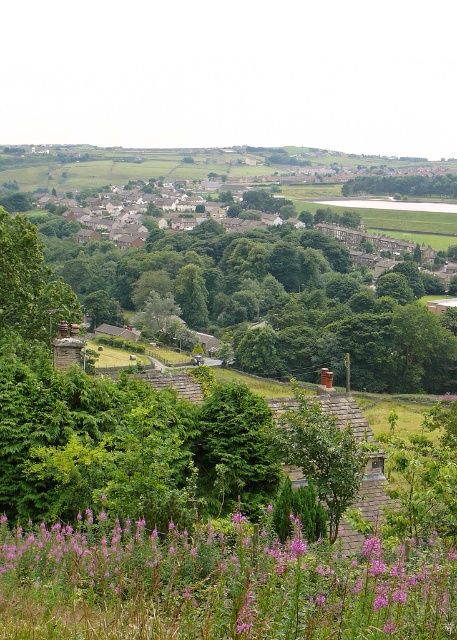
Who is shorter, purple soft-textured flowers at lower center or green leafy tree at center?

Standing shorter between the two is purple soft-textured flowers at lower center.

Between purple soft-textured flowers at lower center and green leafy tree at center, which one is positioned higher?

green leafy tree at center is higher up.

Who is more distant from viewer, (210, 630) or (444, 184)?

The point (444, 184) is more distant.

The height and width of the screenshot is (640, 457). Identify the location of purple soft-textured flowers at lower center. (217, 584).